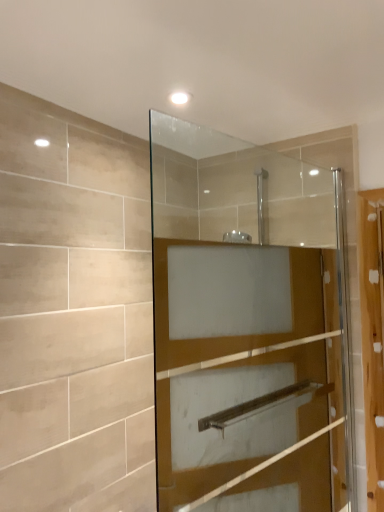
Question: Is wooden screen door at right at the right side of clear glass shower door at center?

Choices:
 (A) no
 (B) yes

Answer: (B)

Question: Can you confirm if wooden screen door at right is smaller than clear glass shower door at center?

Choices:
 (A) yes
 (B) no

Answer: (A)

Question: Is clear glass shower door at center surrounded by wooden screen door at right?

Choices:
 (A) no
 (B) yes

Answer: (A)

Question: Is wooden screen door at right closer to the viewer compared to clear glass shower door at center?

Choices:
 (A) yes
 (B) no

Answer: (B)

Question: Could you tell me if wooden screen door at right is facing clear glass shower door at center?

Choices:
 (A) no
 (B) yes

Answer: (A)

Question: Is the position of wooden screen door at right more distant than that of clear glass shower door at center?

Choices:
 (A) yes
 (B) no

Answer: (A)

Question: From the image's perspective, is clear glass shower door at center located beneath wooden screen door at right?

Choices:
 (A) no
 (B) yes

Answer: (A)

Question: Does clear glass shower door at center have a lesser height compared to wooden screen door at right?

Choices:
 (A) yes
 (B) no

Answer: (B)

Question: Does clear glass shower door at center come in front of wooden screen door at right?

Choices:
 (A) yes
 (B) no

Answer: (A)

Question: Are clear glass shower door at center and wooden screen door at right making contact?

Choices:
 (A) yes
 (B) no

Answer: (B)

Question: Is clear glass shower door at center outside wooden screen door at right?

Choices:
 (A) no
 (B) yes

Answer: (B)

Question: Is wooden screen door at right a part of clear glass shower door at center?

Choices:
 (A) yes
 (B) no

Answer: (B)

Question: Visually, is wooden screen door at right positioned to the left or to the right of clear glass shower door at center?

Choices:
 (A) left
 (B) right

Answer: (B)